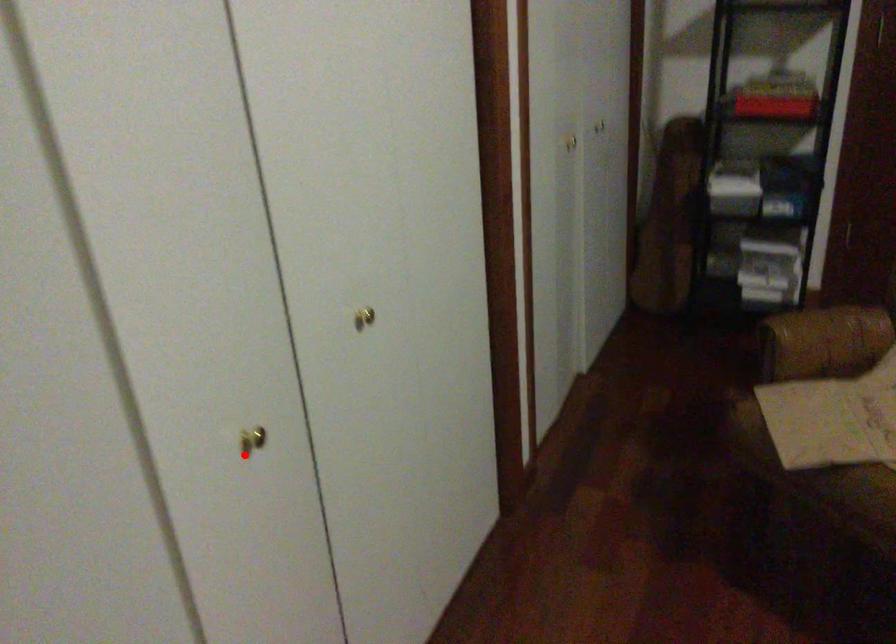
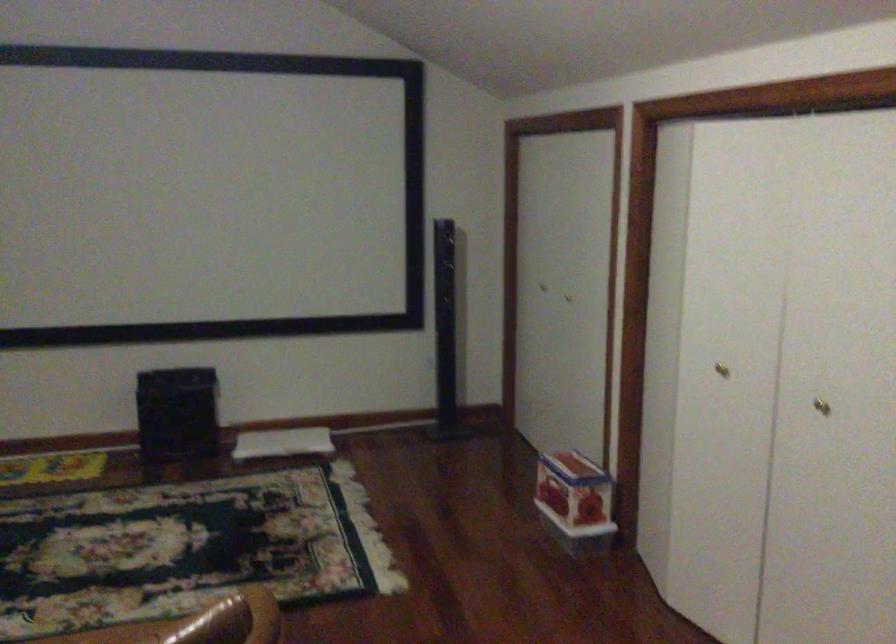
Find the pixel in the second image that matches the highlighted location in the first image.

(721, 368)